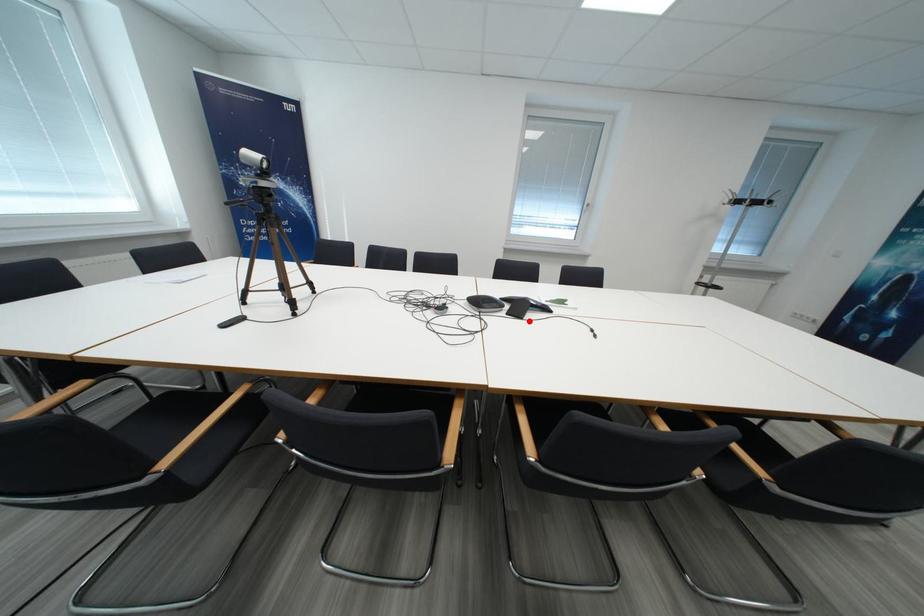
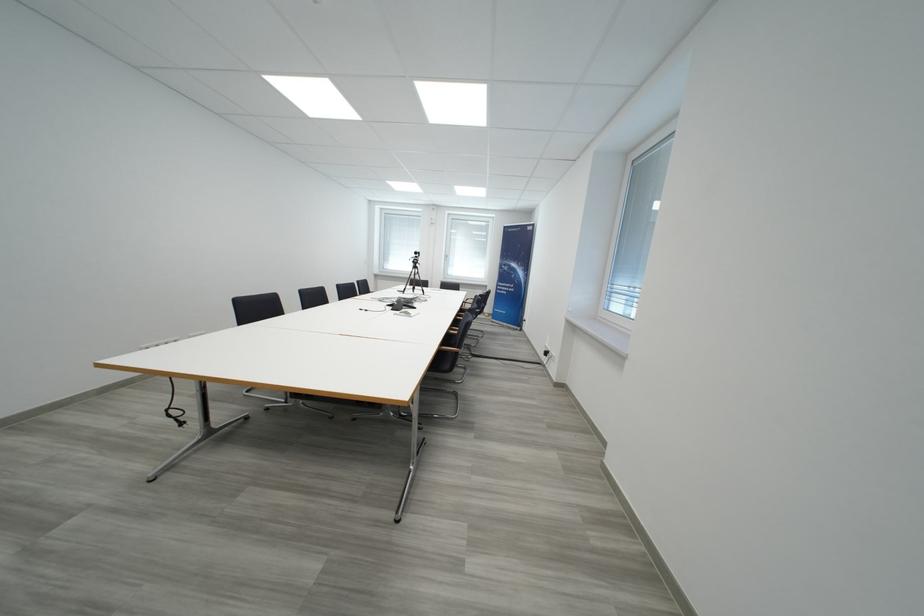
Where in the second image is the point corresponding to the highlighted location from the first image?

(395, 309)